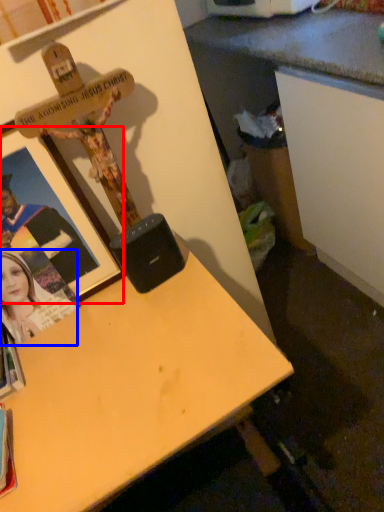
Question: Which point is closer to the camera, picture frame (highlighted by a red box) or person (highlighted by a blue box)?

Choices:
 (A) picture frame
 (B) person

Answer: (A)